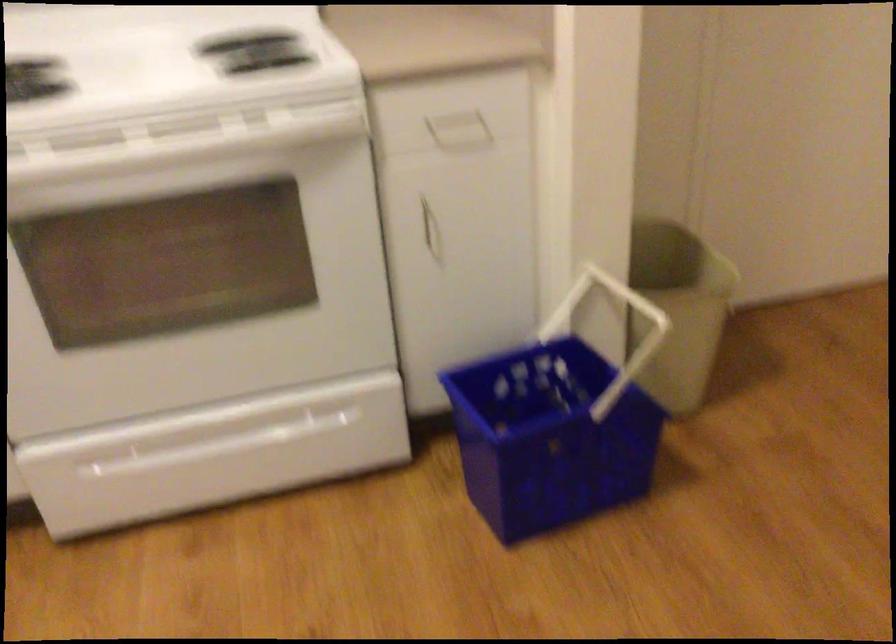
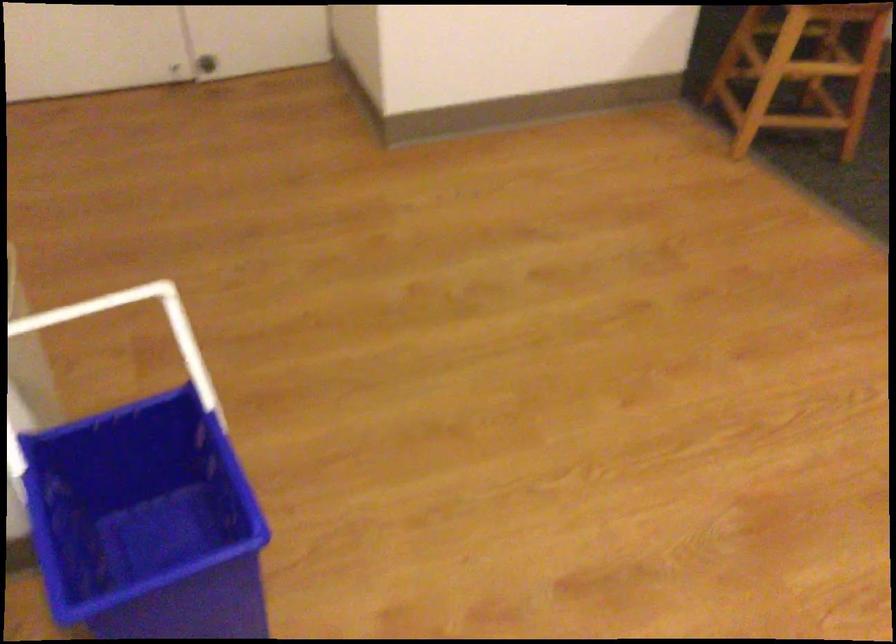
How did the camera likely rotate?

The camera rotated toward right-down.